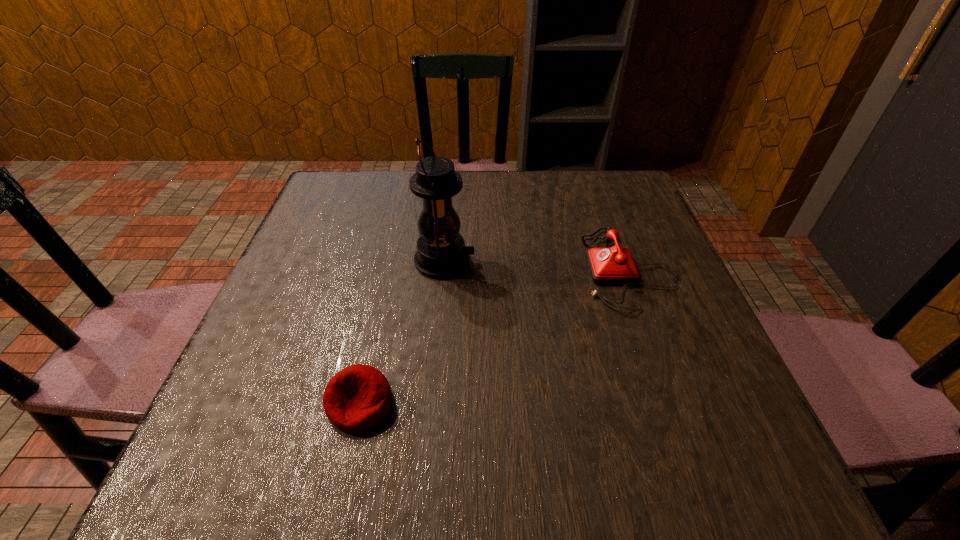
What are the coordinates of `object that is at the right edge` in the screenshot? It's located at (614, 265).

I want to click on blank space at the far edge of the desktop, so click(494, 184).

In order to click on free region at the left edge in this screenshot , I will do `click(271, 370)`.

In order to click on vacant space at the right edge in this screenshot , I will do point(701,325).

Where is `free location at the far left corner`? free location at the far left corner is located at coordinates (348, 180).

Image resolution: width=960 pixels, height=540 pixels. Find the location of `vacant space at the far right corner of the desktop`. vacant space at the far right corner of the desktop is located at coordinates (634, 214).

The height and width of the screenshot is (540, 960). What are the coordinates of `vacant space at the near right corner of the desktop` in the screenshot? It's located at (709, 472).

Where is `vacant space that's between the beanbag and the lantern`? vacant space that's between the beanbag and the lantern is located at coordinates (402, 332).

Identify the location of vacant area that lies between the tallest object and the rightmost object. This screenshot has width=960, height=540. (536, 265).

Where is `vacant area that lies between the lantern and the shortest object`? Image resolution: width=960 pixels, height=540 pixels. vacant area that lies between the lantern and the shortest object is located at coordinates (402, 332).